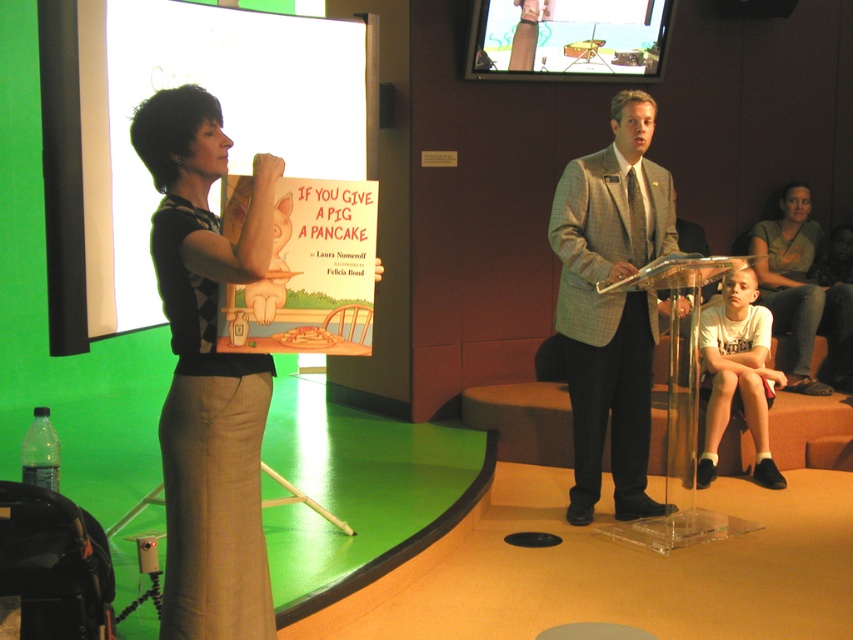
Can you confirm if gray checkered suit at center is thinner than matte plastic tv at upper center?

Yes.

Looking at this image, who is positioned more to the left, gray checkered suit at center or matte plastic tv at upper center?

Positioned to the left is matte plastic tv at upper center.

Locate an element on the screen. The width and height of the screenshot is (853, 640). gray checkered suit at center is located at coordinates (611, 305).

Who is more distant from viewer, (97,234) or (761,227)?

The point (761,227) is more distant.

Does white paper at upper left have a greater height compared to matte green shirt at upper right?

Yes.

Who is more forward, [96,224] or [773,227]?

Point [96,224]

Find the location of `white paper at upper left`. white paper at upper left is located at coordinates (223, 115).

Between point (613, 200) and point (810, 244), which one is positioned behind?

Point (810, 244)

Who is positioned more to the right, gray checkered suit at center or matte green shirt at upper right?

From the viewer's perspective, matte green shirt at upper right appears more on the right side.

Between point (625, 470) and point (761, 252), which one is positioned behind?

Positioned behind is point (761, 252).

Identify the location of gray checkered suit at center. (611, 305).